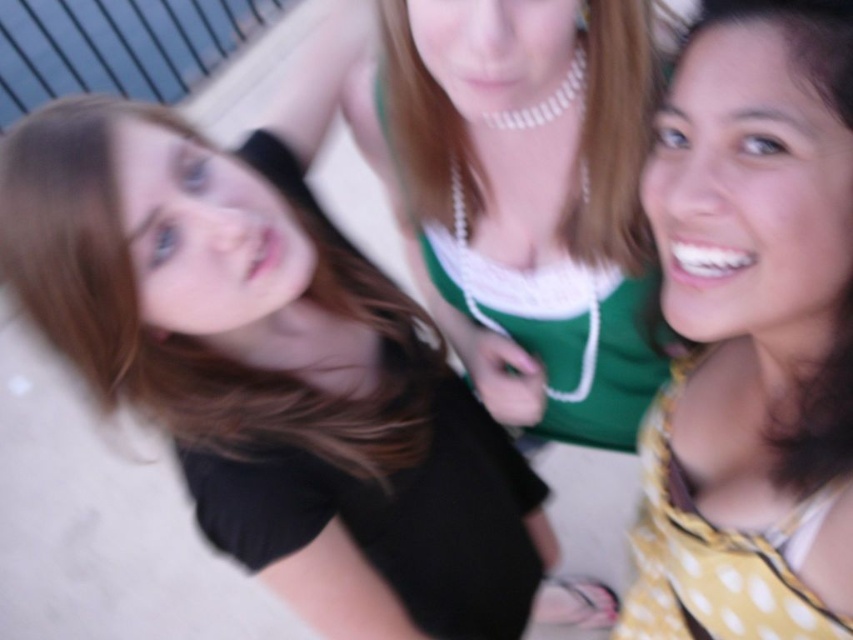
Who is positioned more to the right, yellow dotted scarf at lower right or yellow dotted fabric at lower right?

From the viewer's perspective, yellow dotted scarf at lower right appears more on the right side.

The height and width of the screenshot is (640, 853). Find the location of `yellow dotted scarf at lower right`. yellow dotted scarf at lower right is located at coordinates (751, 332).

This screenshot has height=640, width=853. I want to click on yellow dotted scarf at lower right, so click(x=751, y=332).

Is yellow dotted fabric at lower right below metallic blue balustrade at upper left?

Yes, yellow dotted fabric at lower right is below metallic blue balustrade at upper left.

Is point (648, 538) less distant than point (4, 125)?

Yes, point (648, 538) is in front of point (4, 125).

Identify the location of yellow dotted fabric at lower right. (712, 556).

Can you confirm if black matte dress at lower left is positioned to the right of yellow dotted fabric at lower right?

Incorrect, black matte dress at lower left is not on the right side of yellow dotted fabric at lower right.

Can you confirm if black matte dress at lower left is positioned to the left of yellow dotted fabric at lower right?

Yes, black matte dress at lower left is to the left of yellow dotted fabric at lower right.

Describe the element at coordinates (395, 516) in the screenshot. The image size is (853, 640). I see `black matte dress at lower left` at that location.

Locate an element on the screen. Image resolution: width=853 pixels, height=640 pixels. black matte dress at lower left is located at coordinates (395, 516).